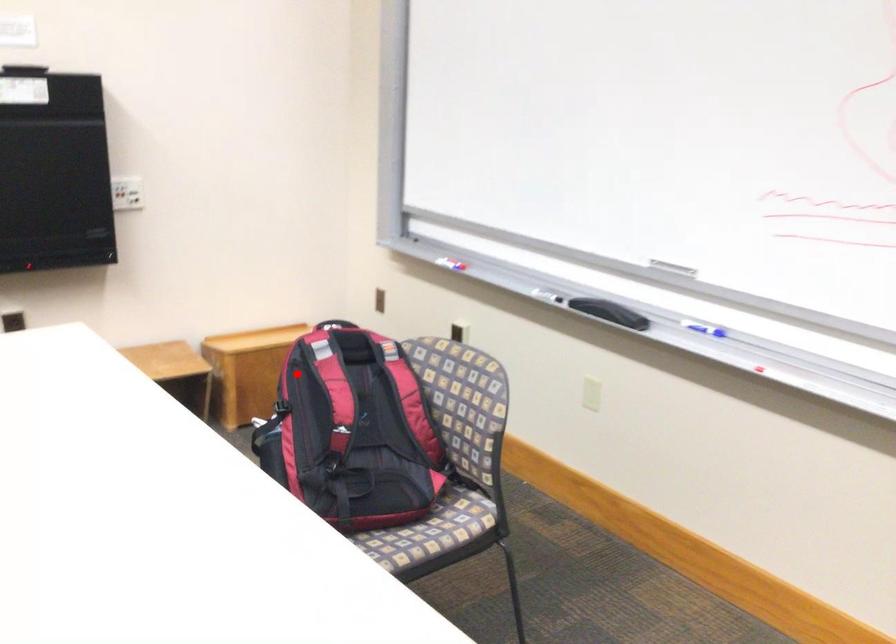
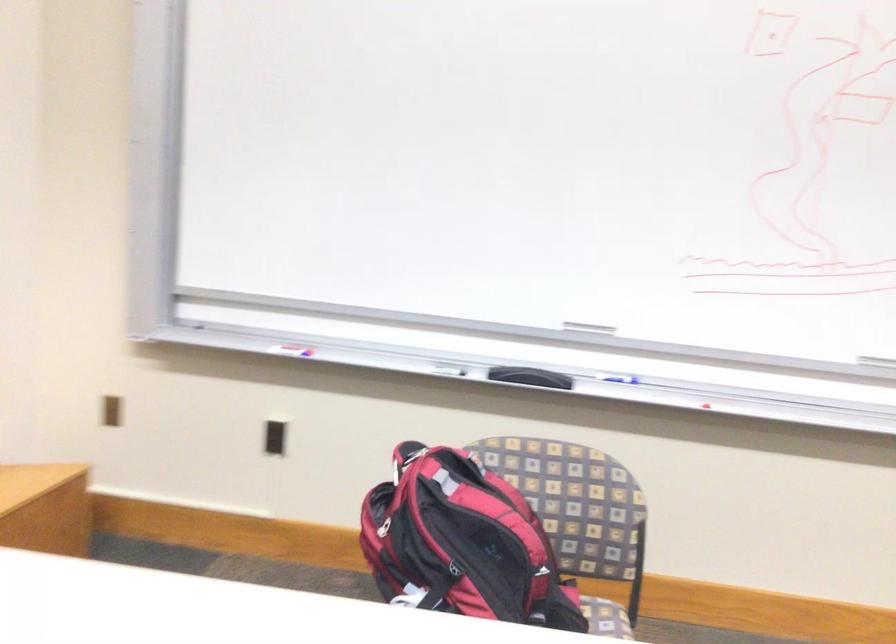
Question: I am providing you with two images of the same scene from different viewpoints. Given a red point in image1, look at the same physical point in image2. Is it:

Choices:
 (A) Closer to the viewpoint
 (B) Farther from the viewpoint

Answer: (A)